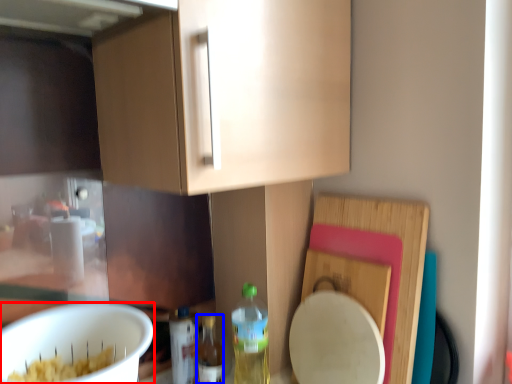
Question: Which of the following is the farthest to the observer, mixing bowl (highlighted by a red box) or bottle (highlighted by a blue box)?

Choices:
 (A) mixing bowl
 (B) bottle

Answer: (B)